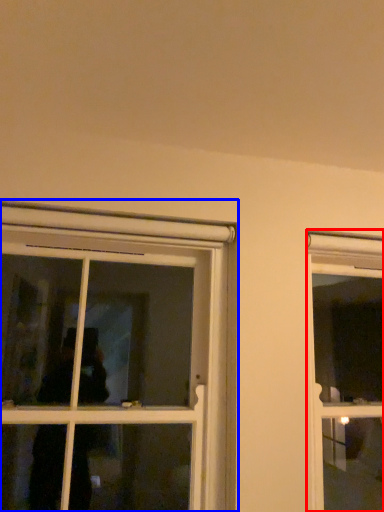
Question: Which object is further to the camera taking this photo, window (highlighted by a red box) or window (highlighted by a blue box)?

Choices:
 (A) window
 (B) window

Answer: (A)